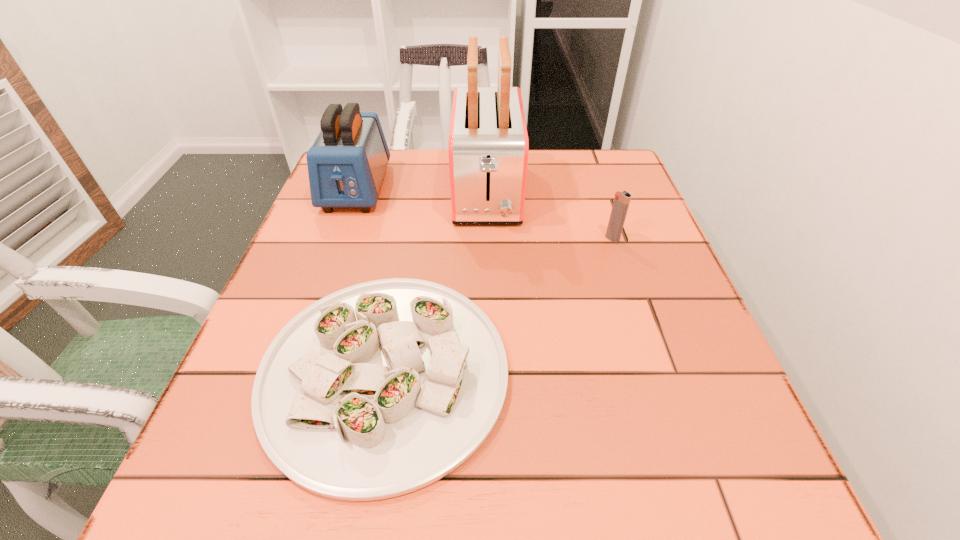
Where is `vacant area situated on the front of the third tallest object`? The image size is (960, 540). vacant area situated on the front of the third tallest object is located at coordinates (647, 342).

Locate an element on the screen. vacant space positioned on the back of the shortest object is located at coordinates (409, 238).

What are the coordinates of `object that is at the near edge` in the screenshot? It's located at (382, 388).

Locate an element on the screen. Image resolution: width=960 pixels, height=540 pixels. toaster present at the left edge is located at coordinates (346, 163).

Image resolution: width=960 pixels, height=540 pixels. I want to click on platter located at the left edge, so click(382, 388).

Locate an element on the screen. The height and width of the screenshot is (540, 960). object that is at the right edge is located at coordinates (622, 200).

Locate an element on the screen. This screenshot has height=540, width=960. object present at the far left corner is located at coordinates (346, 163).

The height and width of the screenshot is (540, 960). What are the coordinates of `object at the near left corner` in the screenshot? It's located at (382, 388).

Image resolution: width=960 pixels, height=540 pixels. I want to click on vacant area at the far edge, so click(x=543, y=177).

Find the location of a particular element. vacant space at the near edge of the desktop is located at coordinates (543, 487).